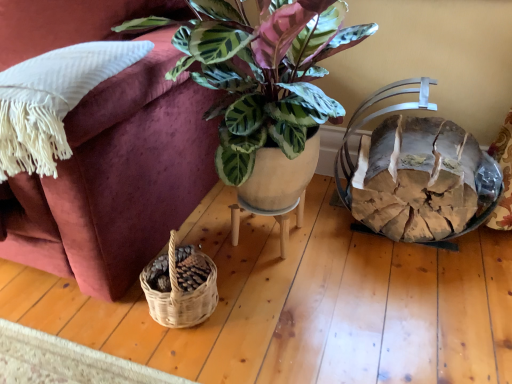
Question: Based on their sizes in the image, would you say matte ceramic pot at center is bigger or smaller than rustic wood log basket at right?

Choices:
 (A) big
 (B) small

Answer: (B)

Question: Is matte ceramic pot at center situated inside rustic wood log basket at right or outside?

Choices:
 (A) inside
 (B) outside

Answer: (B)

Question: Estimate the real-world distances between objects in this image. Which object is farther from the rustic wood log basket at right?

Choices:
 (A) matte ceramic pot at center
 (B) matte ceramic plant at center
 (C) white fringed pillow at left

Answer: (C)

Question: Which is nearer to the matte ceramic pot at center?

Choices:
 (A) matte ceramic plant at center
 (B) white fringed pillow at left
 (C) rustic wood log basket at right

Answer: (C)